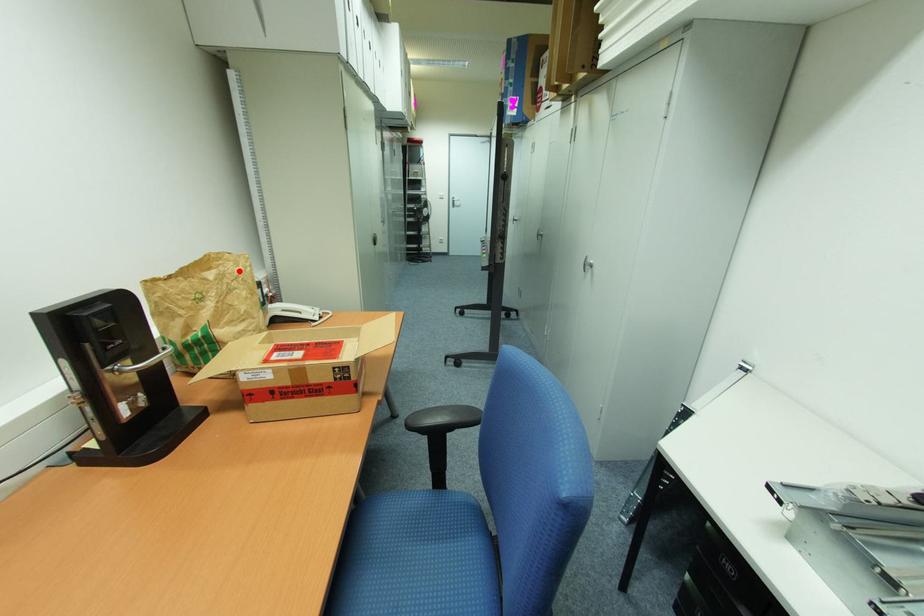
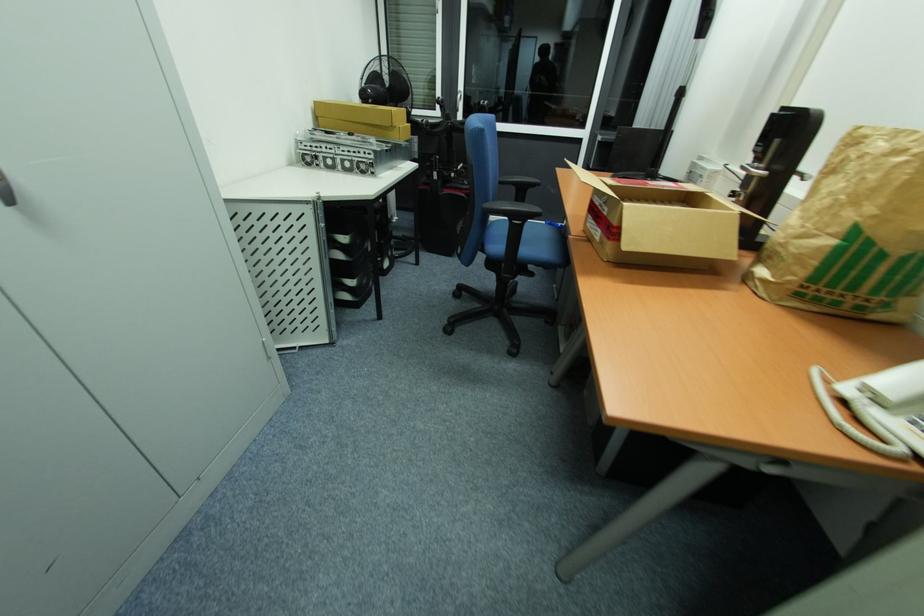
In the second image, find the point that corresponds to the highlighted location in the first image.

(880, 147)